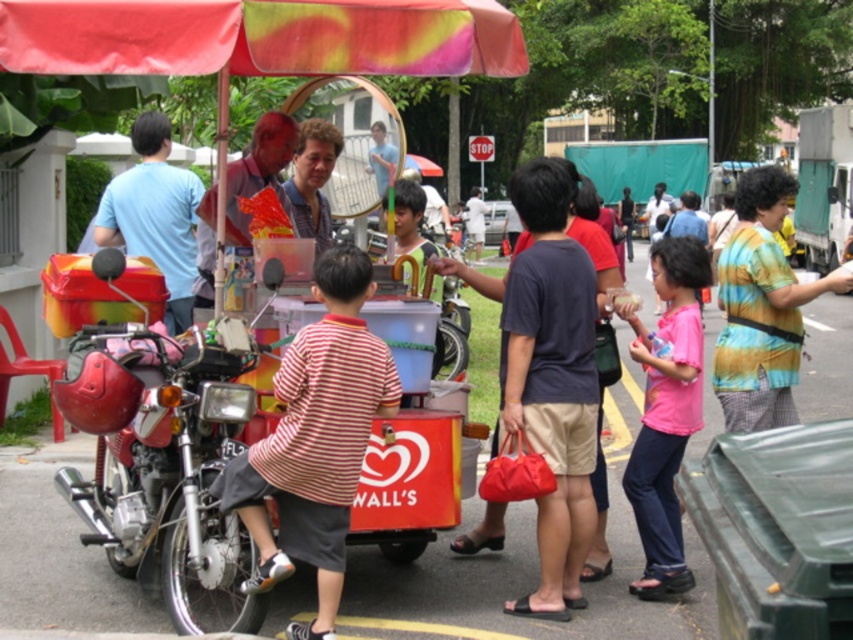
Does point (189, 298) lie in front of point (817, 147)?

That is True.

Which is above, light blue shirt at left or metallic silver food truck at right?

Positioned higher is metallic silver food truck at right.

The image size is (853, 640). Describe the element at coordinates (155, 214) in the screenshot. I see `light blue shirt at left` at that location.

Identify the location of light blue shirt at left. This screenshot has height=640, width=853. (155, 214).